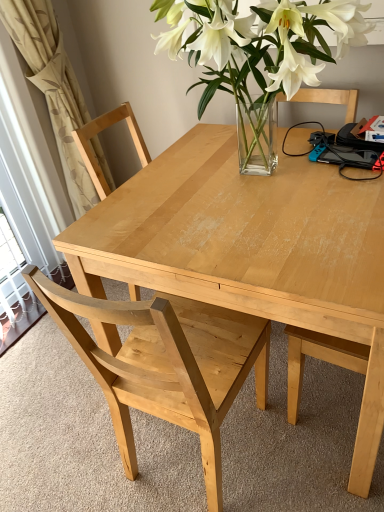
Where is `empty space that is ontop of natural wood table at center (from a real-world perspective)`? The image size is (384, 512). empty space that is ontop of natural wood table at center (from a real-world perspective) is located at coordinates click(256, 187).